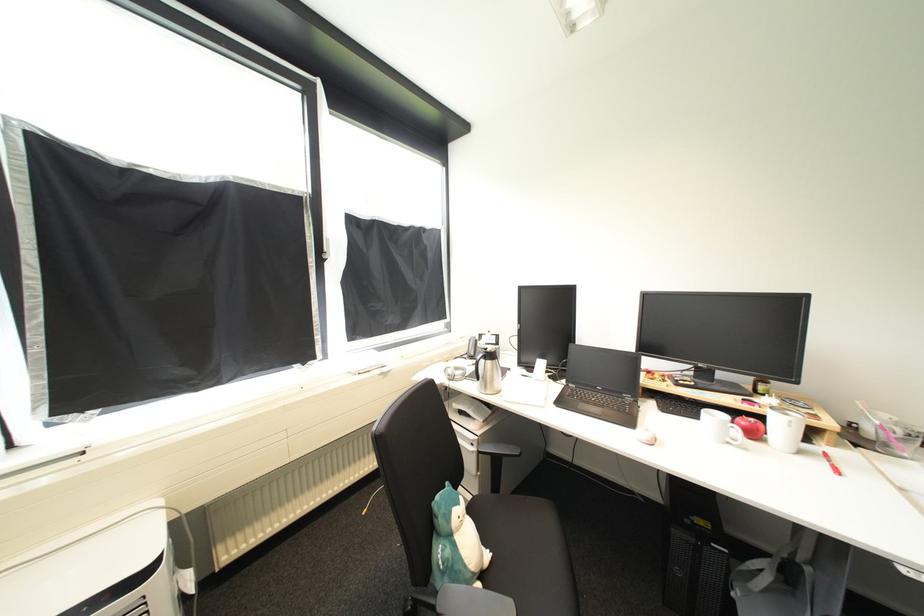
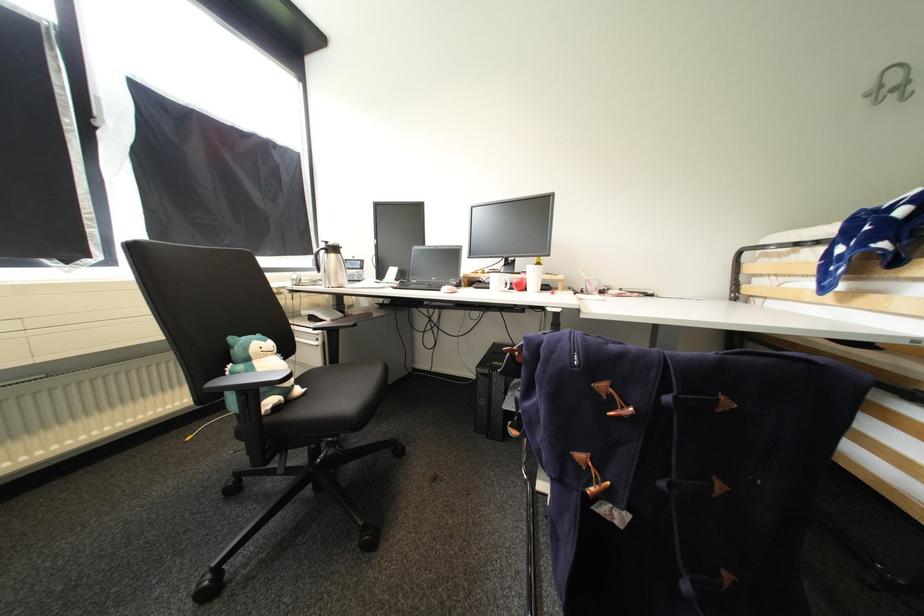
The point at (466, 505) is marked in the first image. Where is the corresponding point in the second image?

(272, 342)